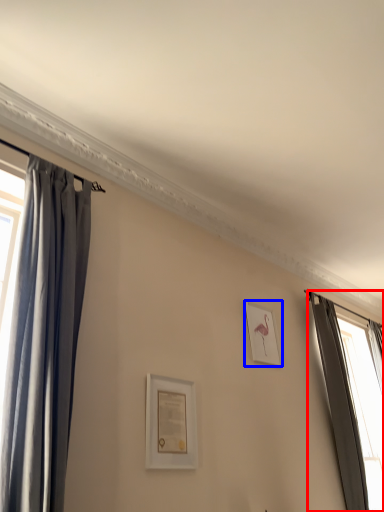
Question: Which object is closer to the camera taking this photo, curtain (highlighted by a red box) or picture frame (highlighted by a blue box)?

Choices:
 (A) curtain
 (B) picture frame

Answer: (A)